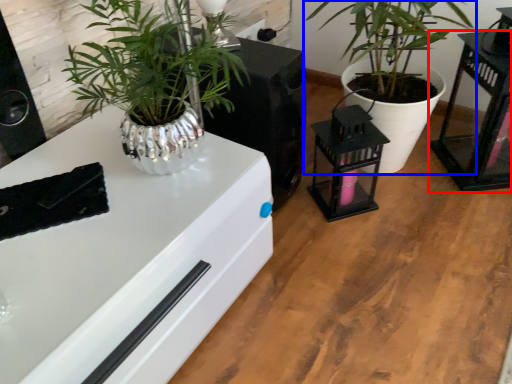
Question: Among these objects, which one is farthest to the camera, table (highlighted by a red box) or houseplant (highlighted by a blue box)?

Choices:
 (A) table
 (B) houseplant

Answer: (A)